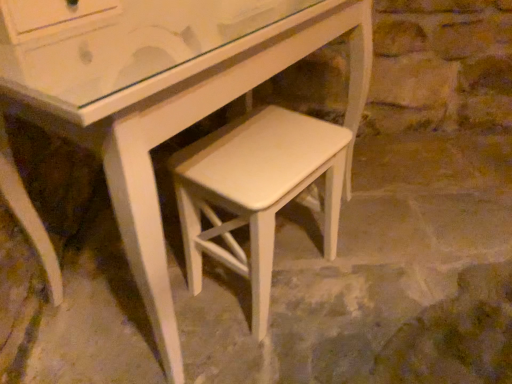
Find the location of `free location in front of white matte stool at center`. free location in front of white matte stool at center is located at coordinates (279, 350).